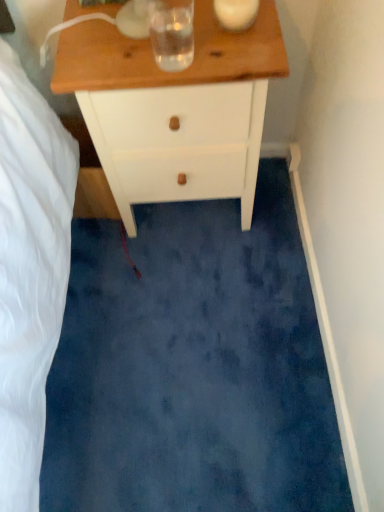
Question: Could you tell me if clear glass water at upper center is turned towards white wood chest of drawers at upper center?

Choices:
 (A) yes
 (B) no

Answer: (B)

Question: Is clear glass water at upper center positioned before white wood chest of drawers at upper center?

Choices:
 (A) no
 (B) yes

Answer: (B)

Question: Is clear glass water at upper center positioned far away from white wood chest of drawers at upper center?

Choices:
 (A) no
 (B) yes

Answer: (A)

Question: From the image's perspective, is clear glass water at upper center under white wood chest of drawers at upper center?

Choices:
 (A) no
 (B) yes

Answer: (A)

Question: From the image's perspective, is clear glass water at upper center on white wood chest of drawers at upper center?

Choices:
 (A) yes
 (B) no

Answer: (A)

Question: Is clear glass water at upper center placed right next to white wood chest of drawers at upper center?

Choices:
 (A) no
 (B) yes

Answer: (A)

Question: Is white wood chest of drawers at upper center aimed at clear glass water at upper center?

Choices:
 (A) no
 (B) yes

Answer: (A)

Question: Does white wood chest of drawers at upper center have a lesser width compared to clear glass water at upper center?

Choices:
 (A) yes
 (B) no

Answer: (B)

Question: From the image's perspective, is white wood chest of drawers at upper center on clear glass water at upper center?

Choices:
 (A) yes
 (B) no

Answer: (B)

Question: Can you confirm if white wood chest of drawers at upper center is bigger than clear glass water at upper center?

Choices:
 (A) yes
 (B) no

Answer: (A)

Question: Is white wood chest of drawers at upper center closer to camera compared to clear glass water at upper center?

Choices:
 (A) yes
 (B) no

Answer: (B)

Question: Is clear glass water at upper center completely or partially inside white wood chest of drawers at upper center?

Choices:
 (A) no
 (B) yes

Answer: (A)

Question: Is point (157, 184) positioned closer to the camera than point (183, 54)?

Choices:
 (A) closer
 (B) farther

Answer: (B)